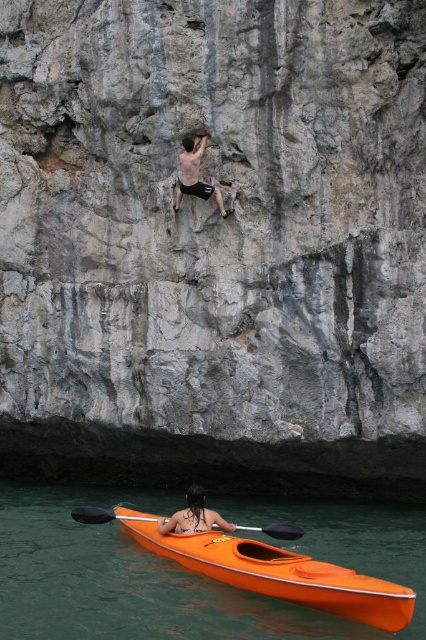
You are a photographer trying to capture the scene from above. The orange plastic kayak at lower center and the dark brown hair at lower center are both in your view. Which object is positioned lower in the image?

The orange plastic kayak at lower center is positioned lower than the dark brown hair at lower center in the image.